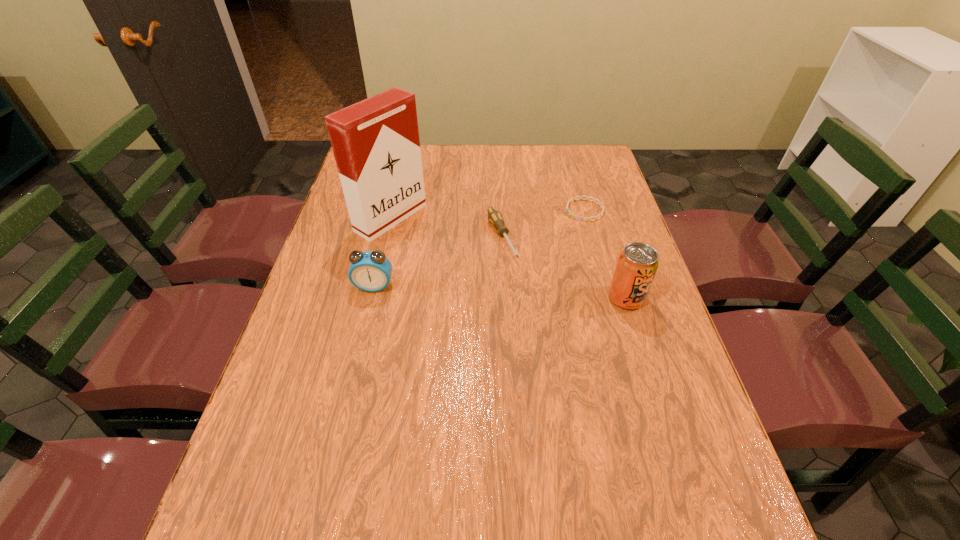
At what (x,y) coordinates should I click in order to perform the action: click on vacant space located on the surface of the shortest object showing star-shaped elements. Please return your answer as a coordinate pair (x, y). The image size is (960, 540). Looking at the image, I should click on (561, 226).

The width and height of the screenshot is (960, 540). I want to click on blank space located 0.270m on the front-facing side of the cigarette_case, so click(485, 273).

The height and width of the screenshot is (540, 960). What are the coordinates of `vacant space located 0.300m on the front-facing side of the cigarette_case` in the screenshot? It's located at (493, 278).

Where is `vacant space located 0.210m on the front-facing side of the cigarette_case`? vacant space located 0.210m on the front-facing side of the cigarette_case is located at coordinates (468, 263).

Find the location of a particular element. free location located 0.130m at the tip of the fourth tallest object is located at coordinates (525, 295).

I want to click on vacant region located at the tip of the fourth tallest object, so click(x=519, y=285).

Locate an element on the screen. Image resolution: width=960 pixels, height=540 pixels. vacant space located 0.200m at the tip of the fourth tallest object is located at coordinates (536, 315).

Locate an element on the screen. The image size is (960, 540). alarm clock located in the left edge section of the desktop is located at coordinates (370, 271).

The image size is (960, 540). Find the location of `cigarette_case that is at the left edge`. cigarette_case that is at the left edge is located at coordinates (376, 145).

Where is `soda can that is at the right edge`? The height and width of the screenshot is (540, 960). soda can that is at the right edge is located at coordinates (637, 264).